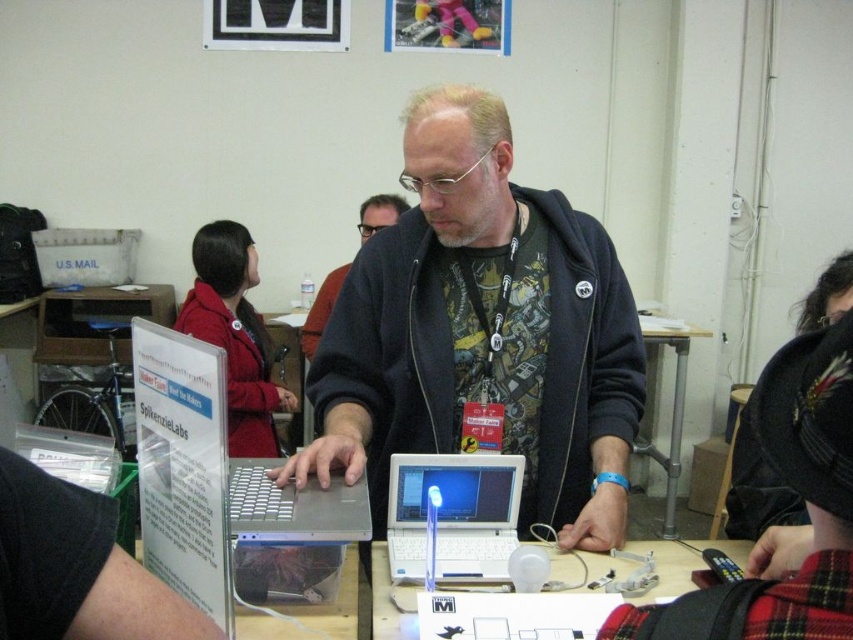
Is brushed metal sign at upper left thinner than metallic silver table at center?

Correct, brushed metal sign at upper left's width is less than metallic silver table at center's.

Is brushed metal sign at upper left to the right of metallic silver table at center from the viewer's perspective?

Incorrect, brushed metal sign at upper left is not on the right side of metallic silver table at center.

Identify the location of brushed metal sign at upper left. This screenshot has height=640, width=853. (77, 566).

The height and width of the screenshot is (640, 853). Find the location of `brushed metal sign at upper left`. brushed metal sign at upper left is located at coordinates (77, 566).

From the picture: Does matte black laptop at center appear under metallic silver table at center?

No.

Is matte black laptop at center taller than metallic silver table at center?

In fact, matte black laptop at center may be shorter than metallic silver table at center.

Is point (474, 362) closer to viewer compared to point (688, 353)?

Yes, point (474, 362) is closer to viewer.

Locate an element on the screen. matte black laptop at center is located at coordinates (480, 332).

Which is above, silver metallic laptop at center or red wool coat at upper left?

red wool coat at upper left is above.

Can you confirm if silver metallic laptop at center is smaller than red wool coat at upper left?

Yes.

Does point (277, 499) lie behind point (201, 336)?

No, (277, 499) is closer to viewer.

The width and height of the screenshot is (853, 640). I want to click on silver metallic laptop at center, so click(216, 458).